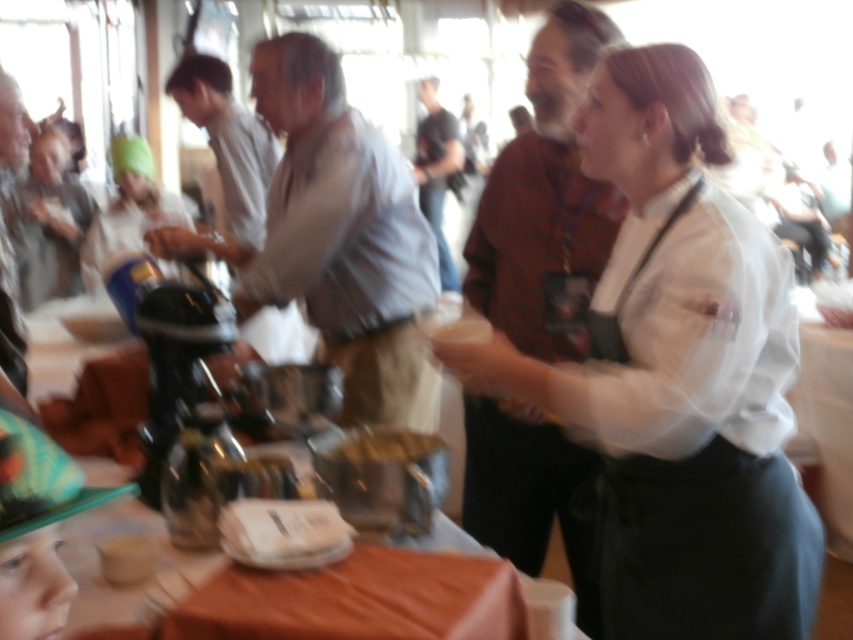
Question: Is orange fabric tablecloth at lower center positioned in front of dark gray shirt at center?

Choices:
 (A) no
 (B) yes

Answer: (B)

Question: Among these objects, which one is nearest to the camera?

Choices:
 (A) dark gray shirt at center
 (B) gray fabric at left
 (C) matte green hat at upper left

Answer: (B)

Question: Can you confirm if gray fabric at left is positioned below dark gray shirt at center?

Choices:
 (A) yes
 (B) no

Answer: (A)

Question: Is gray fabric at left further to the viewer compared to dark gray shirt at center?

Choices:
 (A) yes
 (B) no

Answer: (B)

Question: Which is nearer to the gray fabric at left?

Choices:
 (A) matte green hat at upper left
 (B) orange fabric table at lower center

Answer: (B)

Question: Which of the following is the farthest from the observer?

Choices:
 (A) pos(428,200)
 (B) pos(410,576)
 (C) pos(241,200)

Answer: (A)